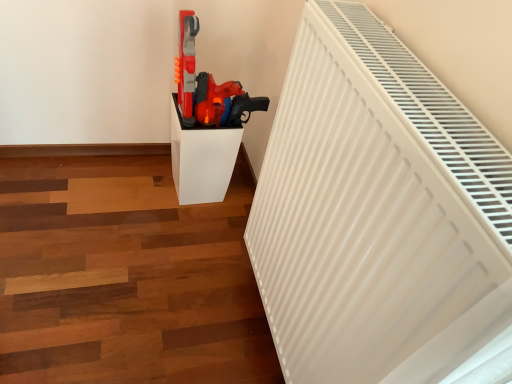
Question: Could you tell me if white matte radiator at upper right is facing white glossy pedestal at center?

Choices:
 (A) yes
 (B) no

Answer: (B)

Question: From a real-world perspective, is white matte radiator at upper right located beneath white glossy pedestal at center?

Choices:
 (A) no
 (B) yes

Answer: (A)

Question: Does white matte radiator at upper right lie behind white glossy pedestal at center?

Choices:
 (A) yes
 (B) no

Answer: (B)

Question: Does white matte radiator at upper right appear on the left side of white glossy pedestal at center?

Choices:
 (A) yes
 (B) no

Answer: (B)

Question: Does white matte radiator at upper right have a lesser height compared to white glossy pedestal at center?

Choices:
 (A) yes
 (B) no

Answer: (B)

Question: Is white matte radiator at upper right inside or outside of matte plastic toy gun at center?

Choices:
 (A) outside
 (B) inside

Answer: (A)

Question: Would you say white matte radiator at upper right is to the left or to the right of matte plastic toy gun at center in the picture?

Choices:
 (A) right
 (B) left

Answer: (A)

Question: In the image, is white matte radiator at upper right positioned in front of or behind matte plastic toy gun at center?

Choices:
 (A) front
 (B) behind

Answer: (A)

Question: From their relative heights in the image, would you say white matte radiator at upper right is taller or shorter than matte plastic toy gun at center?

Choices:
 (A) short
 (B) tall

Answer: (B)

Question: From the image's perspective, is matte plastic toy gun at center above or below white glossy pedestal at center?

Choices:
 (A) above
 (B) below

Answer: (A)

Question: In terms of size, does matte plastic toy gun at center appear bigger or smaller than white glossy pedestal at center?

Choices:
 (A) small
 (B) big

Answer: (A)

Question: Does point (187, 74) appear closer or farther from the camera than point (194, 201)?

Choices:
 (A) farther
 (B) closer

Answer: (B)

Question: Is matte plastic toy gun at center taller or shorter than white glossy pedestal at center?

Choices:
 (A) tall
 (B) short

Answer: (B)

Question: Considering the positions of matte plastic toy gun at center and white matte radiator at upper right in the image, is matte plastic toy gun at center bigger or smaller than white matte radiator at upper right?

Choices:
 (A) small
 (B) big

Answer: (A)

Question: Is matte plastic toy gun at center inside the boundaries of white matte radiator at upper right, or outside?

Choices:
 (A) inside
 (B) outside

Answer: (B)